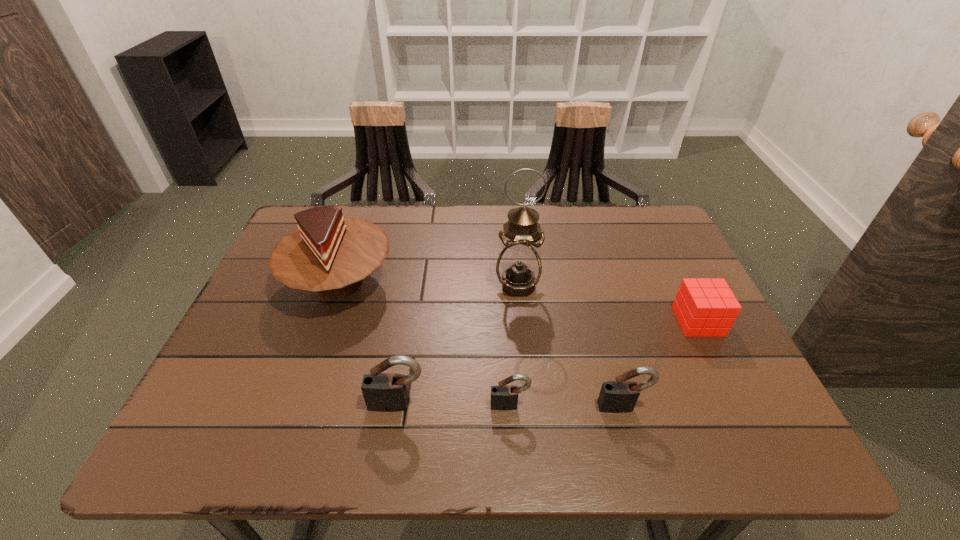
Locate an element on the screen. This screenshot has height=540, width=960. vacant space at the far right corner of the desktop is located at coordinates (658, 240).

Identify the location of free spot at the near right corner of the desktop. (755, 405).

The image size is (960, 540). Find the location of `vacant point located between the third tallest object and the tallest object`. vacant point located between the third tallest object and the tallest object is located at coordinates (458, 345).

Locate an element on the screen. free space between the second tallest object and the second padlock from left to right is located at coordinates (424, 345).

This screenshot has width=960, height=540. In order to click on vacant point located between the rightmost object and the tallest padlock in this screenshot , I will do `click(548, 363)`.

At what (x,y) coordinates should I click in order to perform the action: click on free space between the second tallest object and the cube. Please return your answer as a coordinate pair (x, y). Looking at the image, I should click on (518, 302).

At what (x,y) coordinates should I click in order to perform the action: click on free space between the tallest padlock and the cube. Please return your answer as a coordinate pair (x, y). This screenshot has height=540, width=960. Looking at the image, I should click on (548, 363).

Locate an element on the screen. The height and width of the screenshot is (540, 960). vacant space in between the fourth shortest object and the cake is located at coordinates (369, 344).

Locate an element on the screen. empty space between the second tallest padlock and the cube is located at coordinates (660, 364).

In order to click on unoccupied position between the rightmost object and the rightmost padlock in this screenshot , I will do `click(660, 364)`.